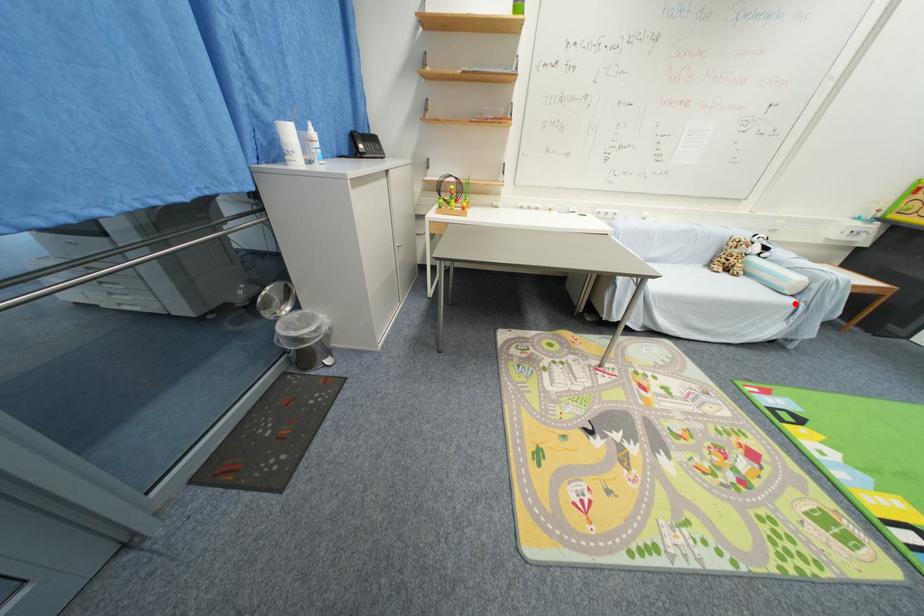
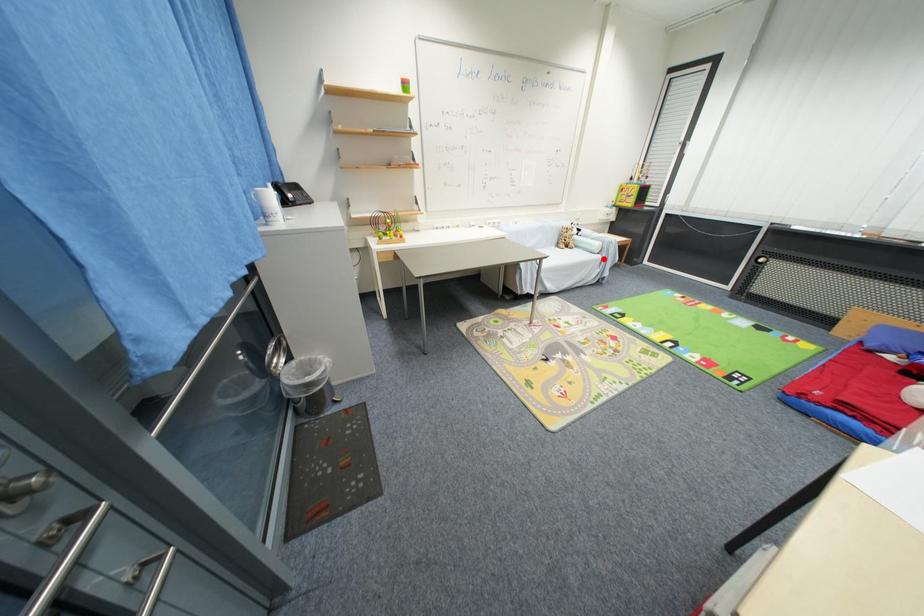
I am providing you with two images of the same scene from different viewpoints. A red point is marked on the first image and another point is marked on the second image. Do the highlighted points in image1 and image2 indicate the same real-world spot?

Yes